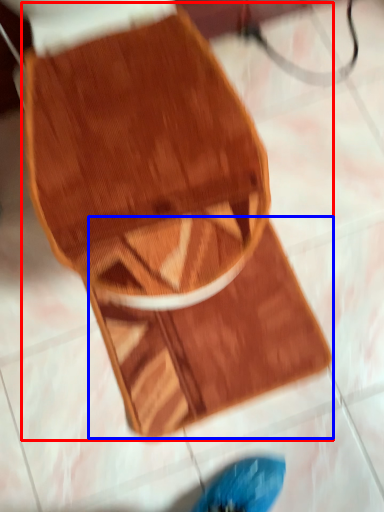
Question: Which object is further to the camera taking this photo, footwear (highlighted by a red box) or mat (highlighted by a blue box)?

Choices:
 (A) footwear
 (B) mat

Answer: (B)